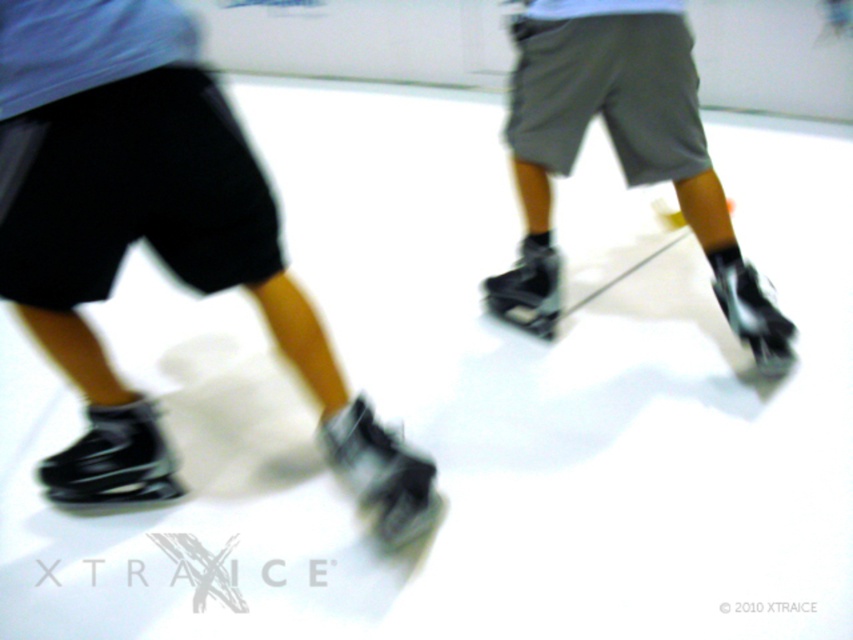
Is matte black skate shoes at center below black leather roller skate at lower left?

Incorrect, matte black skate shoes at center is not positioned below black leather roller skate at lower left.

Who is more forward, (587, 96) or (155, 416)?

Point (155, 416) is more forward.

Is point (585, 35) positioned before point (117, 493)?

No, it is behind (117, 493).

This screenshot has height=640, width=853. I want to click on matte black skate shoes at center, so click(x=621, y=147).

Can you confirm if black matte roller skate at lower center is thinner than black matte roller skate at center?

No, black matte roller skate at lower center is not thinner than black matte roller skate at center.

Does black matte roller skate at lower center appear on the right side of black matte roller skate at center?

No, black matte roller skate at lower center is not to the right of black matte roller skate at center.

Is point (339, 440) more distant than point (523, 312)?

No, (339, 440) is in front of (523, 312).

You are a GUI agent. You are given a task and a screenshot of the screen. Output one action in this format:
    pyautogui.click(x=<x>, y=<y>)
    Task: Click on the black matte roller skate at lower center
    This screenshot has height=640, width=853.
    Given the screenshot: What is the action you would take?
    pyautogui.click(x=380, y=472)

Can you confirm if black matte ice skate at lower left is positioned to the left of black leather roller skate at lower left?

No, black matte ice skate at lower left is not to the left of black leather roller skate at lower left.

The width and height of the screenshot is (853, 640). Describe the element at coordinates (151, 237) in the screenshot. I see `black matte ice skate at lower left` at that location.

Is point (141, 49) less distant than point (163, 440)?

Yes, point (141, 49) is closer to viewer.

Locate an element on the screen. black matte ice skate at lower left is located at coordinates (151, 237).